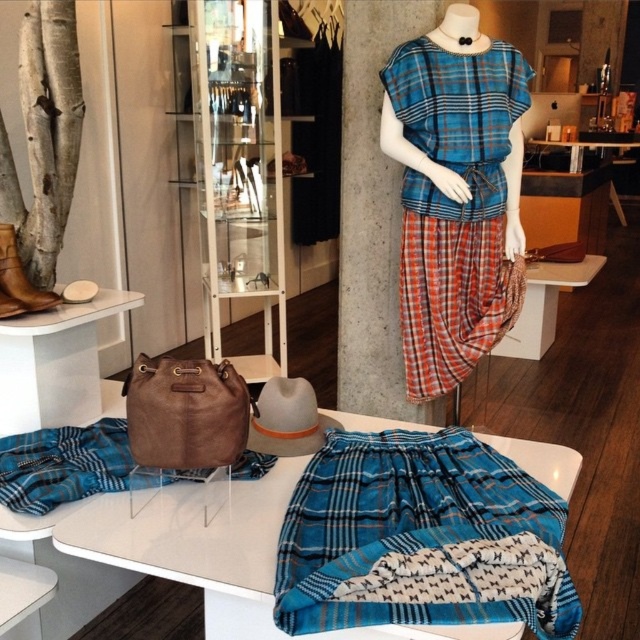
Question: Is blue plaid dress at center to the right of suede plaid skirt at lower left from the viewer's perspective?

Choices:
 (A) yes
 (B) no

Answer: (A)

Question: Which of the following is the closest to the observer?

Choices:
 (A) blue plaid dress at center
 (B) suede plaid skirt at lower left

Answer: (B)

Question: In this image, where is blue plaid skirt at center located relative to suede plaid skirt at lower left?

Choices:
 (A) below
 (B) above

Answer: (A)

Question: Is blue plaid dress at center closer to the viewer compared to brown leather boot at left?

Choices:
 (A) no
 (B) yes

Answer: (A)

Question: Among these points, which one is nearest to the camera?

Choices:
 (A) (449, 465)
 (B) (515, 58)
 (C) (12, 436)

Answer: (A)

Question: Which point is farther from the camera taking this photo?

Choices:
 (A) (54, 296)
 (B) (116, 436)
 (C) (408, 381)
 (D) (497, 566)

Answer: (C)